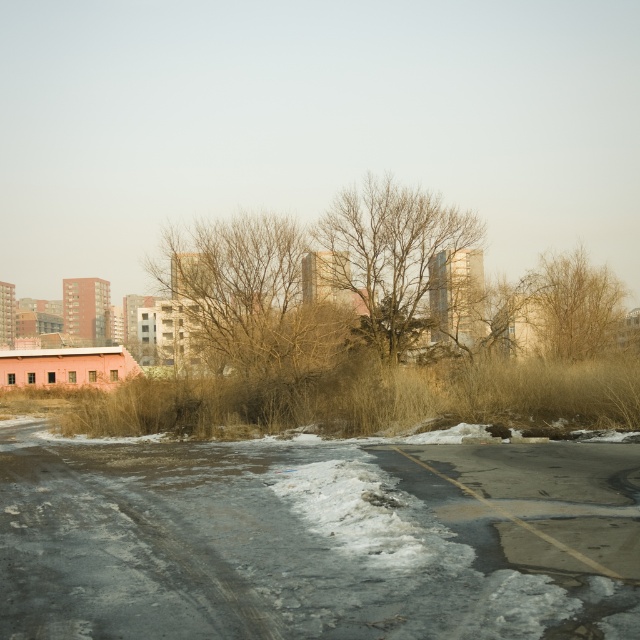
In the scene shown: Can you confirm if white powdery snow at center is smaller than brown dry grass at right?

Correct, white powdery snow at center occupies less space than brown dry grass at right.

Measure the distance between white powdery snow at center and camera.

A distance of 5.98 meters exists between white powdery snow at center and camera.

This screenshot has width=640, height=640. Find the location of `white powdery snow at center`. white powdery snow at center is located at coordinates (314, 538).

Measure the distance between bare branches at center and brown dry grass at right.

bare branches at center and brown dry grass at right are 7.65 meters apart.

What are the coordinates of `bare branches at center` in the screenshot? It's located at (390, 253).

Identify the location of bare branches at center. The image size is (640, 640). (390, 253).

Find the location of `white powdery snow at center`. white powdery snow at center is located at coordinates (314, 538).

Based on the photo, does white powdery snow at center have a greater width compared to bare branches at center?

Yes, white powdery snow at center is wider than bare branches at center.

Is point (289, 502) positioned behind point (428, 259)?

No.

At what (x,y) coordinates should I click in order to perform the action: click on white powdery snow at center. Please return your answer as a coordinate pair (x, y). Looking at the image, I should click on (314, 538).